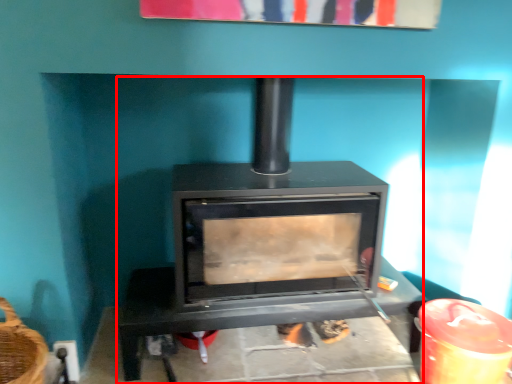
Question: From the image's perspective, where is wood burning stove (annotated by the red box) located relative to furniture?

Choices:
 (A) below
 (B) above

Answer: (B)